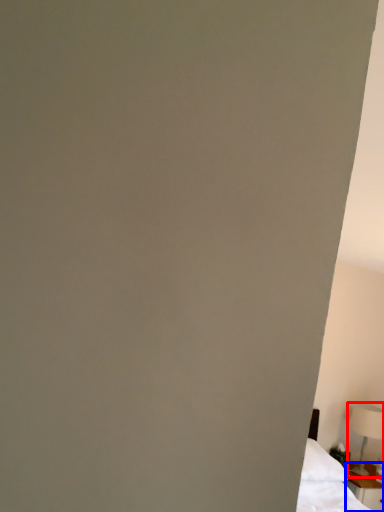
Question: Which point is closer to the camera, table lamp (highlighted by a red box) or nightstand (highlighted by a blue box)?

Choices:
 (A) table lamp
 (B) nightstand

Answer: (B)